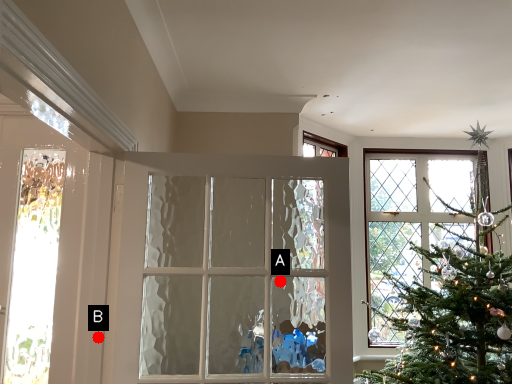
Question: Two points are circled on the image, labeled by A and B beside each circle. Which point is farther to the camera?

Choices:
 (A) A is further
 (B) B is further

Answer: (A)